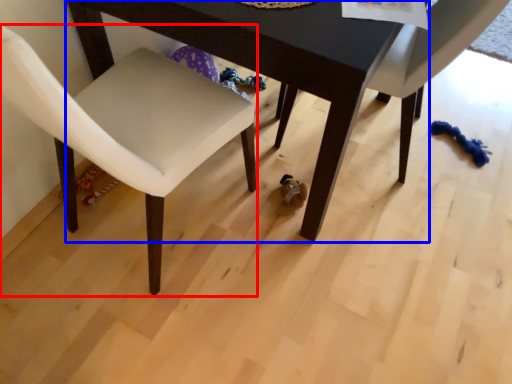
Question: Which of the following is the farthest to the observer, chair (highlighted by a red box) or table (highlighted by a blue box)?

Choices:
 (A) chair
 (B) table

Answer: (B)